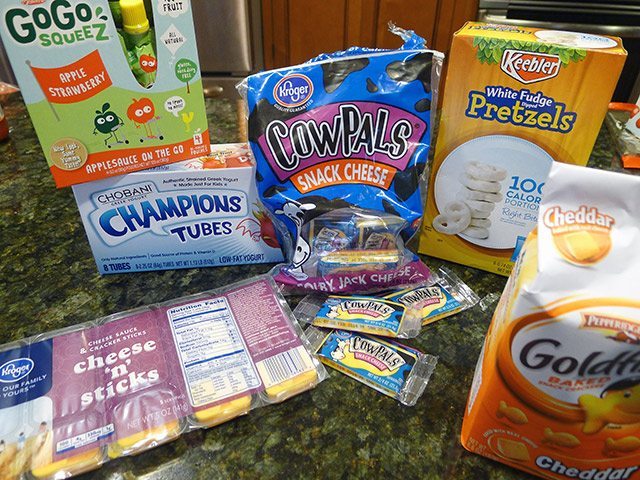
Where is `counter top`? The width and height of the screenshot is (640, 480). counter top is located at coordinates (331, 429).